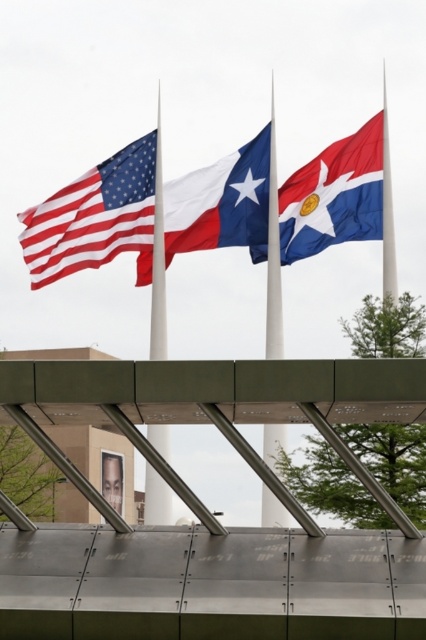
Is matte fabric american flag at left below american flag at center?

Indeed, matte fabric american flag at left is positioned under american flag at center.

At what (x,y) coordinates should I click in order to perform the action: click on matte fabric american flag at left. Please return your answer as a coordinate pair (x, y). This screenshot has height=640, width=426. Looking at the image, I should click on (94, 216).

This screenshot has width=426, height=640. Identify the location of matte fabric american flag at left. (94, 216).

Which is below, blue and white fabric flag at upper right or polished silver flag pole at center?

polished silver flag pole at center is lower down.

Between point (293, 211) and point (271, 204), which one is positioned in front?

Positioned in front is point (271, 204).

What do you see at coordinates (334, 195) in the screenshot?
I see `blue and white fabric flag at upper right` at bounding box center [334, 195].

Locate an element on the screen. blue and white fabric flag at upper right is located at coordinates (334, 195).

The height and width of the screenshot is (640, 426). What do you see at coordinates (94, 216) in the screenshot? I see `matte fabric american flag at left` at bounding box center [94, 216].

Which of these two, matte fabric american flag at left or blue and white fabric flag at upper right, stands shorter?

With less height is blue and white fabric flag at upper right.

Does point (140, 154) come behind point (374, 216)?

That is True.

Locate an element on the screen. matte fabric american flag at left is located at coordinates (94, 216).